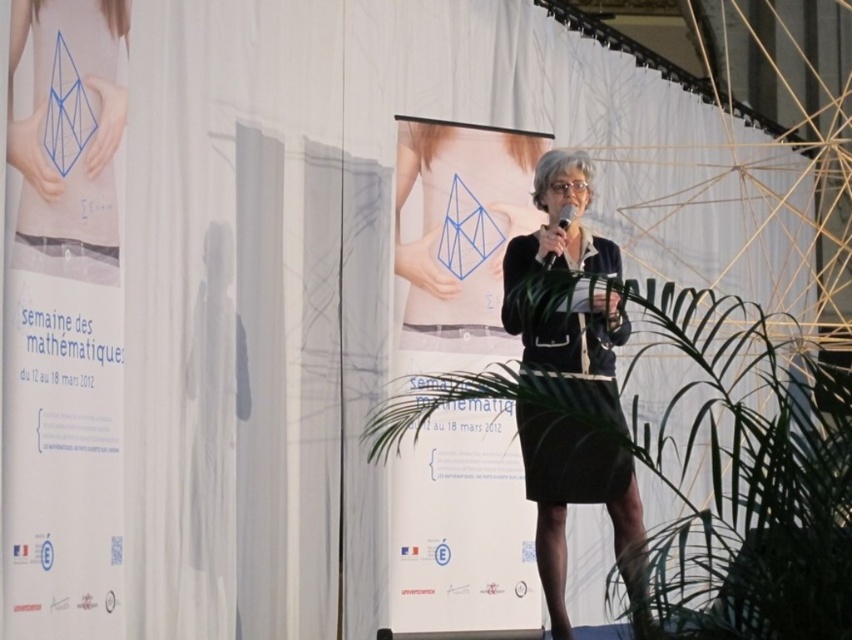
Can you confirm if blue paper dress at upper left is bigger than black plastic microphone at center?

Correct, blue paper dress at upper left is larger in size than black plastic microphone at center.

Is blue paper dress at upper left smaller than black plastic microphone at center?

No, blue paper dress at upper left is not smaller than black plastic microphone at center.

Does point (90, 205) come in front of point (570, 221)?

Yes, it is in front of point (570, 221).

Locate an element on the screen. The image size is (852, 640). blue paper dress at upper left is located at coordinates (87, 138).

From the picture: Is black fabric skirt at center above black plastic microphone at center?

No.

Is black fabric skirt at center closer to camera compared to black plastic microphone at center?

Yes, it is in front of black plastic microphone at center.

Find the location of a particular element. This screenshot has width=852, height=640. black fabric skirt at center is located at coordinates (584, 296).

The width and height of the screenshot is (852, 640). Identify the location of black fabric skirt at center. (584, 296).

Does black fabric skirt at center have a lesser height compared to black matte dress at center?

Incorrect, black fabric skirt at center's height does not fall short of black matte dress at center's.

Does black fabric skirt at center have a smaller size compared to black matte dress at center?

Incorrect, black fabric skirt at center is not smaller in size than black matte dress at center.

What do you see at coordinates (584, 296) in the screenshot? I see `black fabric skirt at center` at bounding box center [584, 296].

Locate an element on the screen. This screenshot has height=640, width=852. black fabric skirt at center is located at coordinates (584, 296).